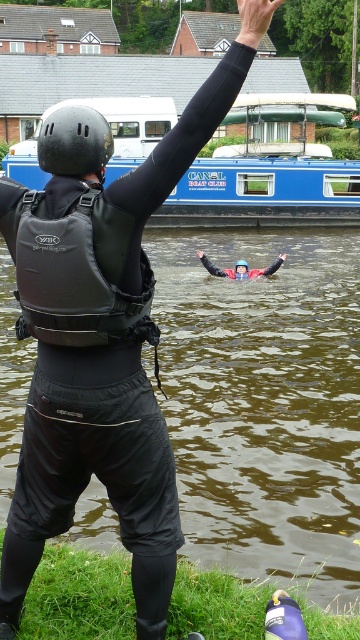
You are a safety inspector assessing the safety of the water activity setup. The red rubber life jacket at center must be within 10 inches of the black matte arm at upper center for quick access. Based on the scene, is the current placement compliant with safety regulations?

The distance between the red rubber life jacket at center and the black matte arm at upper center is 10.03 inches, which exceeds the required 10 inches. Therefore, the current placement does not comply with safety regulations.

I am a tourist standing at the point marked by the coordinates (240, 268). I see a red rubber life jacket at center. Where should I go to find the CANAL BOAT CLUB boat?

The CANAL BOAT CLUB boat is docked along the canal in the background, so you should move towards the background from the red rubber life jacket at center to find it.